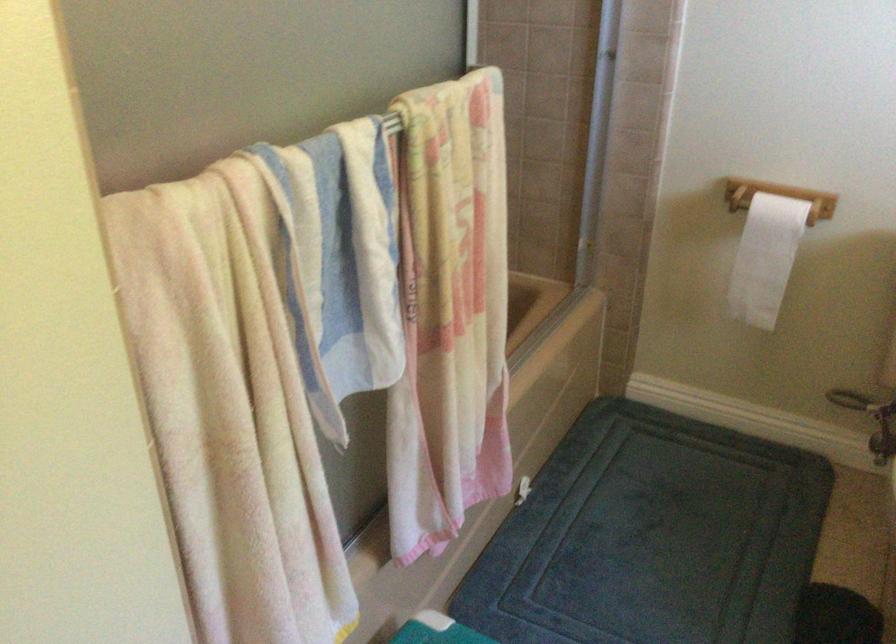
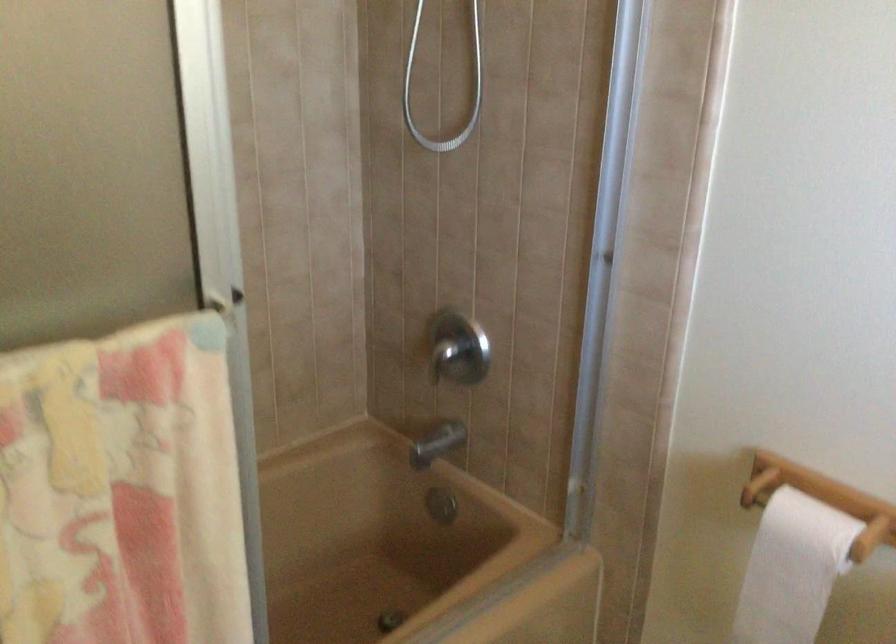
Find the pixel in the second image that matches pixel 769 240 in the first image.

(791, 569)